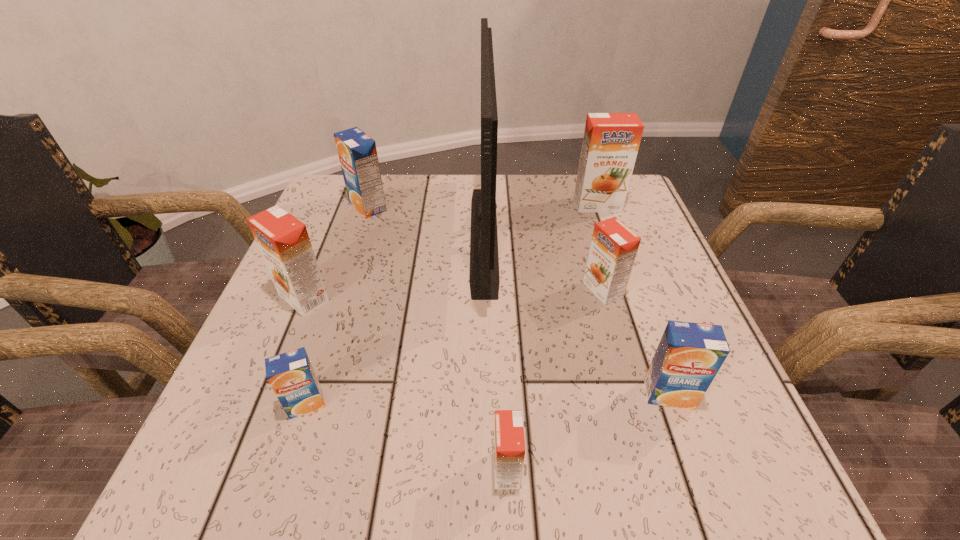
The height and width of the screenshot is (540, 960). I want to click on monitor present at the far edge, so click(x=484, y=279).

Where is `object present at the near edge`? The image size is (960, 540). object present at the near edge is located at coordinates (509, 445).

Locate an element on the screen. object at the far left corner is located at coordinates [x=357, y=152].

This screenshot has height=540, width=960. I want to click on object present at the far right corner, so click(611, 141).

The image size is (960, 540). Find the location of `free space at the near edge of the desktop`. free space at the near edge of the desktop is located at coordinates (623, 480).

The width and height of the screenshot is (960, 540). In the image, there is a desktop. In order to click on free space at the left edge in this screenshot , I will do `click(330, 234)`.

The height and width of the screenshot is (540, 960). I want to click on free space at the far left corner, so click(x=384, y=180).

This screenshot has height=540, width=960. Find the location of `blank space at the near left corner of the desktop`. blank space at the near left corner of the desktop is located at coordinates (295, 468).

The height and width of the screenshot is (540, 960). In the image, there is a desktop. Identify the location of free space at the far right corner. (616, 212).

At what (x,y) coordinates should I click in order to perform the action: click on free space that is in between the smallest blue orange_juice and the second biggest blue orange_juice. Please return your answer as a coordinate pair (x, y). Looking at the image, I should click on (488, 399).